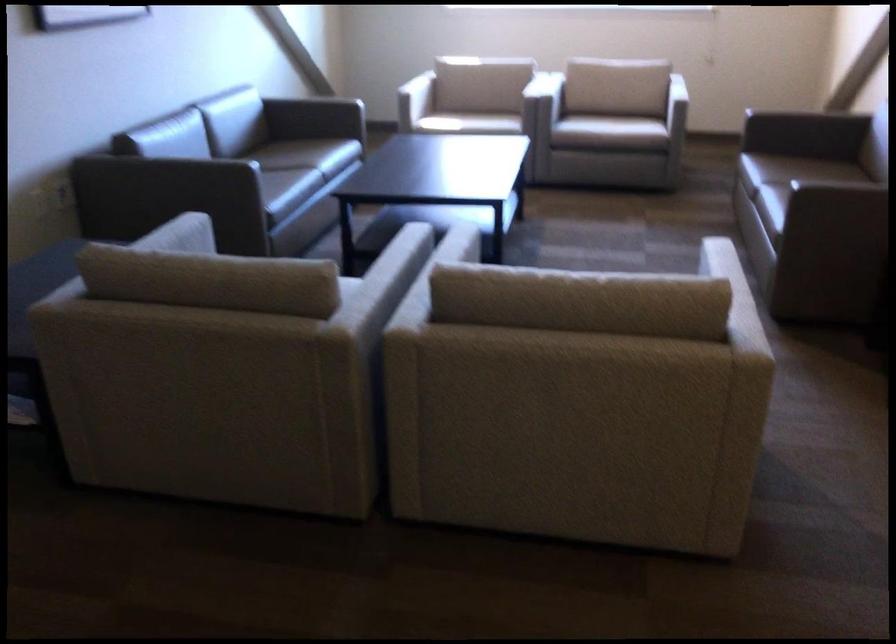
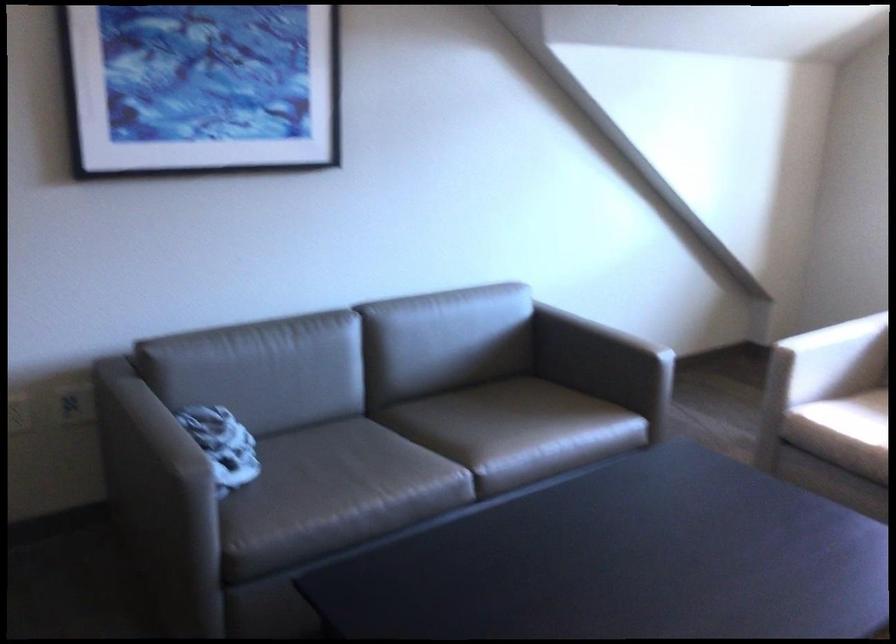
Locate, in the second image, the point that corresponds to (x=220, y=174) in the first image.

(158, 491)